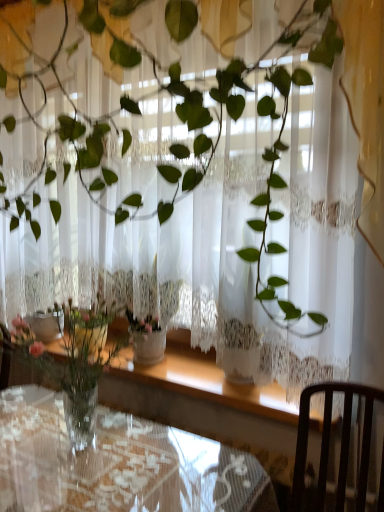
Question: Considering the positions of dark wood chair at lower right and clear glass table at center in the image, is dark wood chair at lower right taller or shorter than clear glass table at center?

Choices:
 (A) tall
 (B) short

Answer: (B)

Question: Considering the positions of dark wood chair at lower right and clear glass table at center in the image, is dark wood chair at lower right wider or thinner than clear glass table at center?

Choices:
 (A) thin
 (B) wide

Answer: (A)

Question: Is dark wood chair at lower right to the left or to the right of clear glass table at center in the image?

Choices:
 (A) left
 (B) right

Answer: (B)

Question: In terms of size, does clear glass table at center appear bigger or smaller than dark wood chair at lower right?

Choices:
 (A) big
 (B) small

Answer: (A)

Question: Is clear glass table at center in front of or behind dark wood chair at lower right in the image?

Choices:
 (A) front
 (B) behind

Answer: (B)

Question: In terms of height, does clear glass table at center look taller or shorter compared to dark wood chair at lower right?

Choices:
 (A) short
 (B) tall

Answer: (B)

Question: From a real-world perspective, is clear glass table at center physically located above or below dark wood chair at lower right?

Choices:
 (A) below
 (B) above

Answer: (A)